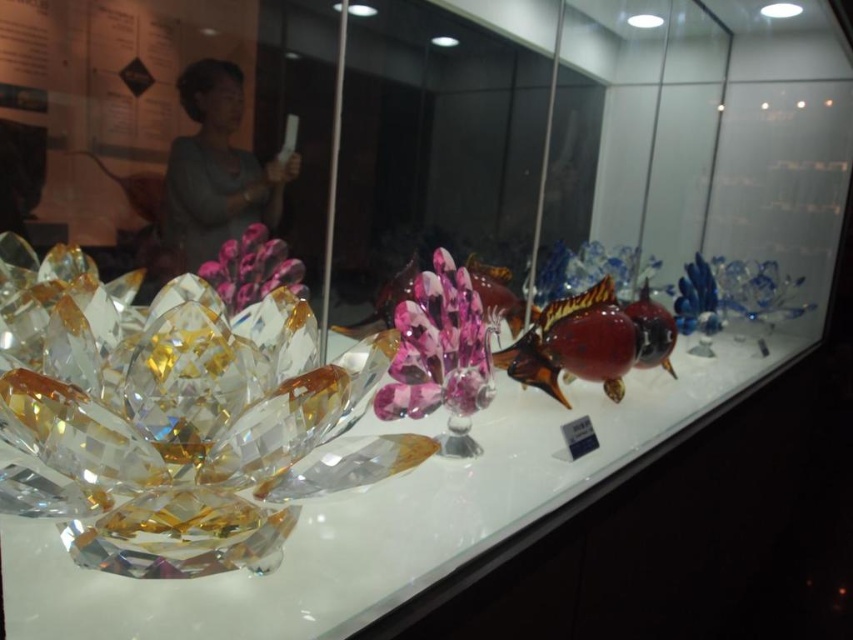
From the picture: Is transparent crystal lotus at lower left to the right of gray fabric at upper left from the viewer's perspective?

Correct, you'll find transparent crystal lotus at lower left to the right of gray fabric at upper left.

Which is more to the left, transparent crystal lotus at lower left or gray fabric at upper left?

From the viewer's perspective, gray fabric at upper left appears more on the left side.

At what (x,y) coordinates should I click in order to perform the action: click on transparent crystal lotus at lower left. Please return your answer as a coordinate pair (x, y). Looking at the image, I should click on (386, 518).

Locate an element on the screen. This screenshot has height=640, width=853. transparent crystal lotus at lower left is located at coordinates coord(386,518).